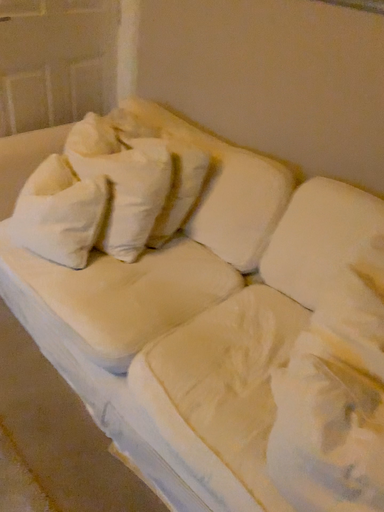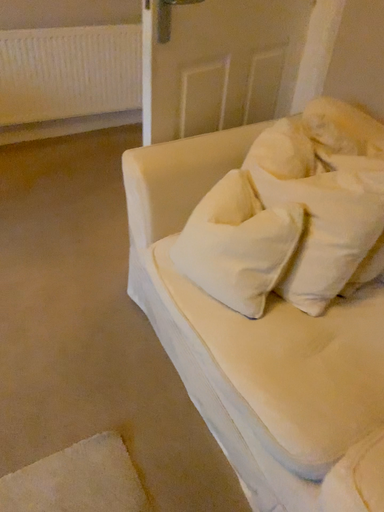
Question: Which way did the camera rotate in the video?

Choices:
 (A) rotated right
 (B) rotated left

Answer: (B)